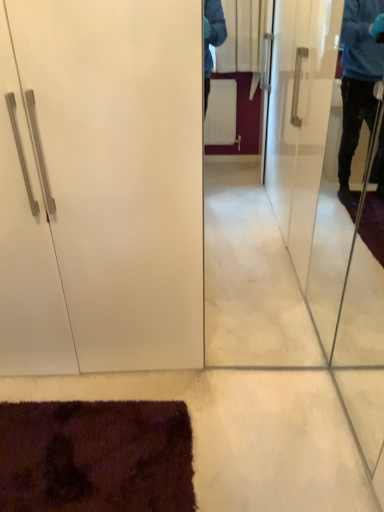
Question: From a real-world perspective, is transparent glass screen door at right above or below white glossy cabinet at left?

Choices:
 (A) above
 (B) below

Answer: (B)

Question: From the image's perspective, relative to white glossy cabinet at left, is transparent glass screen door at right above or below?

Choices:
 (A) above
 (B) below

Answer: (B)

Question: Which is correct: transparent glass screen door at right is inside white glossy cabinet at left, or outside of it?

Choices:
 (A) outside
 (B) inside

Answer: (A)

Question: Considering the positions of white glossy cabinet at left and transparent glass screen door at right in the image, is white glossy cabinet at left taller or shorter than transparent glass screen door at right?

Choices:
 (A) tall
 (B) short

Answer: (A)

Question: Would you say white glossy cabinet at left is to the left or to the right of transparent glass screen door at right in the picture?

Choices:
 (A) left
 (B) right

Answer: (A)

Question: In the image, is white glossy cabinet at left positioned in front of or behind transparent glass screen door at right?

Choices:
 (A) behind
 (B) front

Answer: (A)

Question: From a real-world perspective, is white glossy cabinet at left above or below transparent glass screen door at right?

Choices:
 (A) above
 (B) below

Answer: (A)